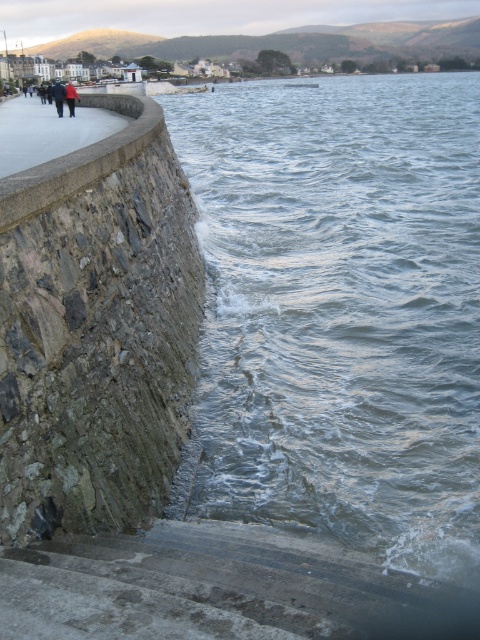
Question: Can you confirm if concrete walkway at left is positioned above red jacket at upper left?

Choices:
 (A) no
 (B) yes

Answer: (A)

Question: Is dark blue jacket at upper left to the right of red jacket at upper left from the viewer's perspective?

Choices:
 (A) yes
 (B) no

Answer: (B)

Question: Which object appears farthest from the camera in this image?

Choices:
 (A) concrete walkway at left
 (B) red jacket at upper left
 (C) gray/rough water at lower right
 (D) dark blue jacket at upper left

Answer: (B)

Question: Which object is closer to the camera taking this photo?

Choices:
 (A) dark blue jacket at upper left
 (B) red jacket at upper left

Answer: (A)

Question: Which of the following is the closest to the observer?

Choices:
 (A) (148, 397)
 (B) (420, 216)
 (C) (45, 122)
 (D) (63, 88)

Answer: (A)

Question: Does concrete walkway at left appear on the left side of dark blue jacket at upper left?

Choices:
 (A) yes
 (B) no

Answer: (B)